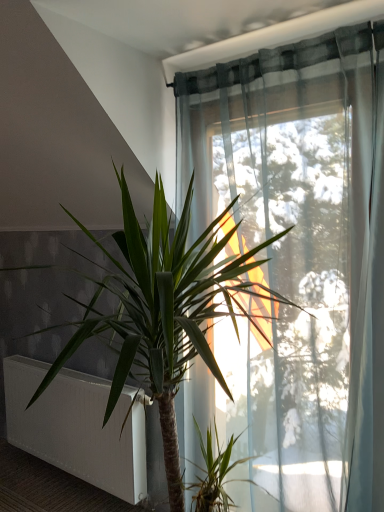
The image size is (384, 512). What do you see at coordinates (77, 426) in the screenshot?
I see `white matte radiator at lower left` at bounding box center [77, 426].

At what (x,y) coordinates should I click in order to perform the action: click on white matte radiator at lower left. Please return your answer as a coordinate pair (x, y). This screenshot has width=384, height=512. Looking at the image, I should click on (77, 426).

Measure the distance between point (46, 375) and camera.

Point (46, 375) and camera are 3.97 feet apart.

Describe the element at coordinates (163, 310) in the screenshot. The width and height of the screenshot is (384, 512). I see `green leafy plant at center` at that location.

Where is `green leafy plant at center`? The image size is (384, 512). green leafy plant at center is located at coordinates (163, 310).

Identify the location of white matte radiator at lower left. (77, 426).

From the picture: Considering the relative positions of white matte radiator at lower left and green leafy plant at center in the image provided, is white matte radiator at lower left to the right of green leafy plant at center from the viewer's perspective?

In fact, white matte radiator at lower left is to the left of green leafy plant at center.

Considering their positions, is white matte radiator at lower left located in front of or behind green leafy plant at center?

white matte radiator at lower left is positioned farther from the viewer than green leafy plant at center.

Does point (143, 417) appear closer or farther from the camera than point (161, 413)?

Point (143, 417) appears to be farther away from the viewer than point (161, 413).

From the image's perspective, which object appears higher, white matte radiator at lower left or green leafy plant at center?

green leafy plant at center appears higher in the image.

From a real-world perspective, which object stands above the other?

In real-world perspective, green leafy plant at center is above.

Does white matte radiator at lower left have a greater width compared to green leafy plant at center?

Incorrect, the width of white matte radiator at lower left does not surpass that of green leafy plant at center.

In terms of height, does white matte radiator at lower left look taller or shorter compared to green leafy plant at center?

In the image, white matte radiator at lower left appears to be shorter than green leafy plant at center.

Which of these two, white matte radiator at lower left or green leafy plant at center, is bigger?

With larger size is green leafy plant at center.

Choose the correct answer: Is white matte radiator at lower left inside green leafy plant at center or outside it?

white matte radiator at lower left lies outside green leafy plant at center.

Would you consider white matte radiator at lower left to be distant from green leafy plant at center?

No, there isn't a large distance between white matte radiator at lower left and green leafy plant at center.

Is white matte radiator at lower left facing towards green leafy plant at center?

No.

Locate an element on the screen. This screenshot has height=512, width=384. houseplant in front of the white matte radiator at lower left is located at coordinates (163, 310).

Which is more to the right, green leafy plant at center or white matte radiator at lower left?

green leafy plant at center.

Is the position of green leafy plant at center more distant than that of white matte radiator at lower left?

No, green leafy plant at center is in front of white matte radiator at lower left.

Is point (169, 402) closer or farther from the camera than point (5, 404)?

Point (169, 402) appears to be closer to the viewer than point (5, 404).

From the image's perspective, does green leafy plant at center appear lower than white matte radiator at lower left?

Incorrect, from the image's perspective, green leafy plant at center is higher than white matte radiator at lower left.

From a real-world perspective, between green leafy plant at center and white matte radiator at lower left, who is vertically lower?

white matte radiator at lower left is physically lower.

Is green leafy plant at center wider or thinner than white matte radiator at lower left?

green leafy plant at center is wider than white matte radiator at lower left.

Consider the image. Considering the relative sizes of green leafy plant at center and white matte radiator at lower left in the image provided, is green leafy plant at center taller than white matte radiator at lower left?

Yes, green leafy plant at center is taller than white matte radiator at lower left.

Between green leafy plant at center and white matte radiator at lower left, which one has smaller size?

white matte radiator at lower left.

Can white matte radiator at lower left be found inside green leafy plant at center?

No.

Can you see green leafy plant at center touching white matte radiator at lower left?

No, green leafy plant at center is not touching white matte radiator at lower left.

Is green leafy plant at center turned away from white matte radiator at lower left?

green leafy plant at center is not turned away from white matte radiator at lower left.

How much distance is there between green leafy plant at center and white matte radiator at lower left?

green leafy plant at center and white matte radiator at lower left are 65.81 centimeters apart from each other.

This screenshot has height=512, width=384. I want to click on radiator on the left of green leafy plant at center, so click(x=77, y=426).

Locate an element on the screen. radiator on the left of green leafy plant at center is located at coordinates (77, 426).

Find the location of a particular element. The image size is (384, 512). radiator located underneath the green leafy plant at center (from a real-world perspective) is located at coordinates [x=77, y=426].